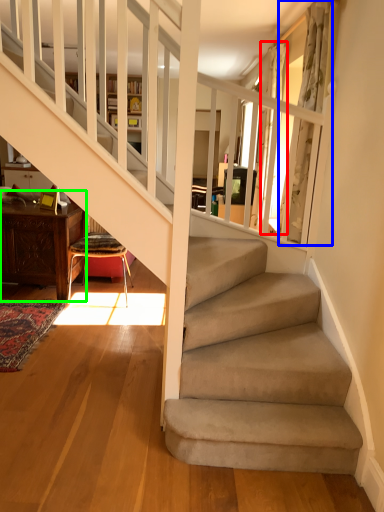
Question: Which object is the farthest from curtain (highlighted by a red box)? Choose among these: curtain (highlighted by a blue box) or table (highlighted by a green box).

Choices:
 (A) curtain
 (B) table

Answer: (B)